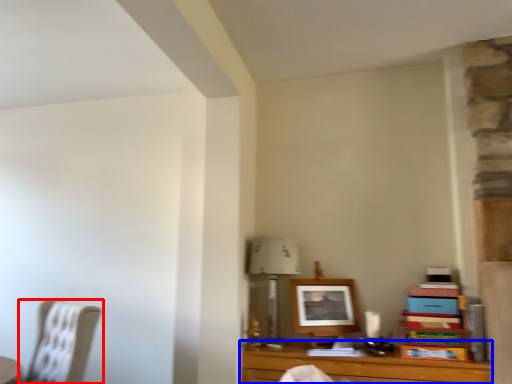
Question: Which object appears closest to the camera in this image, chair (highlighted by a red box) or table (highlighted by a blue box)?

Choices:
 (A) chair
 (B) table

Answer: (B)